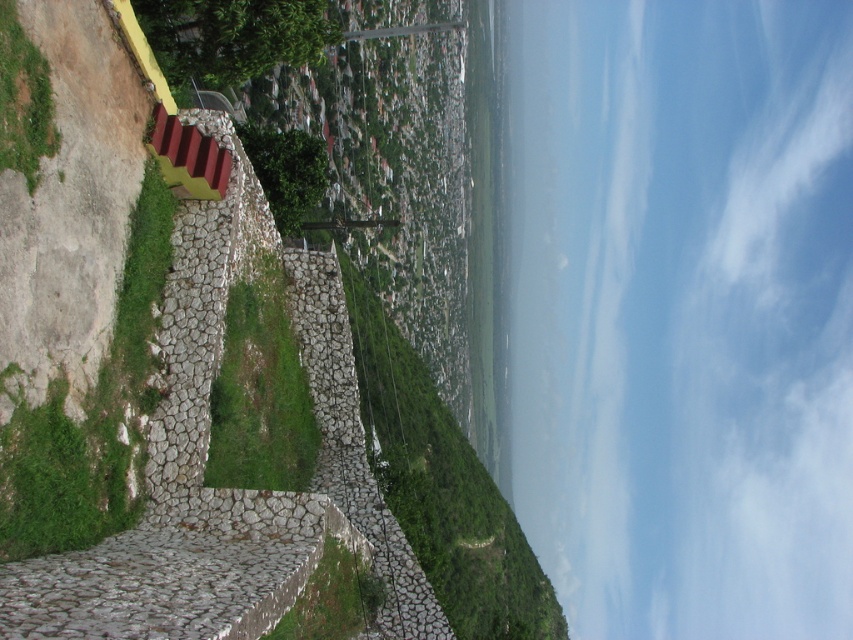
You are standing on a stone pathway and want to walk towards the green grass at center. Which direction should you move relative to the green leafy grass at lower left?

The green grass at center is below the green leafy grass at lower left, so you should move downward from the green leafy grass at lower left to reach the green grass at center.

You are standing at the vantage point looking at the urban landscape. There are two points marked in the scene, one at coordinates point [154,256] and another at point [329,540]. Which of these points is closer to your current position?

Point [154,256] is closer to your current position because it is further to the camera than point [329,540].

Consider the image. You are standing at the vantage point overlooking the urban landscape and notice the green mossy stone at lower left. If you want to reach it without moving your feet, can you touch it with a 15 meter long stick?

The green mossy stone at lower left is 16.43 meters away from viewer. Since the stick is only 15 meters long, you cannot reach it.